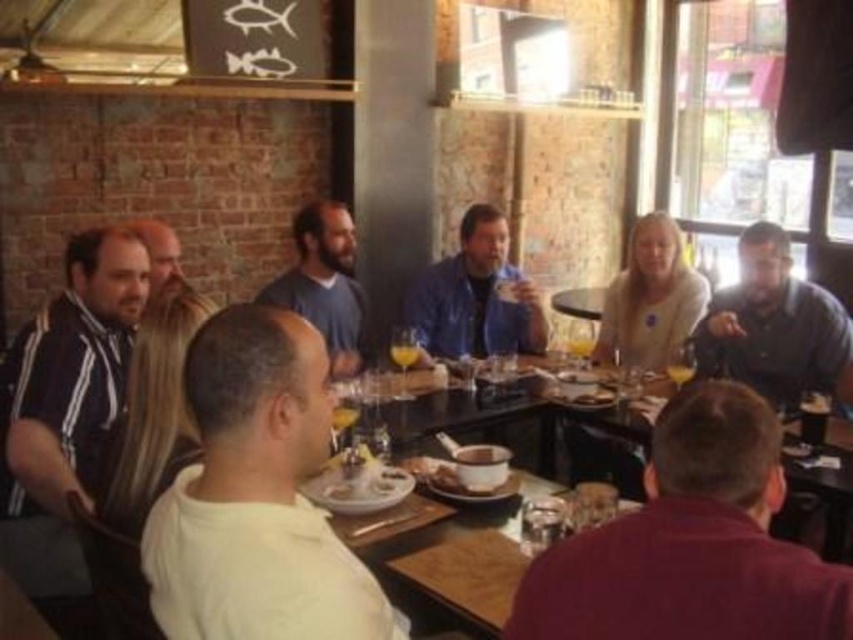
Which of these two, maroon sweater at lower right or blue denim jacket at center, stands taller?

Standing taller between the two is blue denim jacket at center.

In the scene shown: Can you confirm if maroon sweater at lower right is shorter than blue denim jacket at center?

Yes, maroon sweater at lower right is shorter than blue denim jacket at center.

At what (x,y) coordinates should I click in order to perform the action: click on maroon sweater at lower right. Please return your answer as a coordinate pair (x, y). The image size is (853, 640). Looking at the image, I should click on (691, 544).

Where is `maroon sweater at lower right`? Image resolution: width=853 pixels, height=640 pixels. maroon sweater at lower right is located at coordinates (691, 544).

Between wooden table at center and bearded man at left, which one has more height?

bearded man at left

Measure the distance between point (456, 572) and camera.

They are 5.86 feet apart.

Identify the location of wooden table at center. (467, 573).

This screenshot has height=640, width=853. What are the coordinates of `wooden table at center` in the screenshot? It's located at (467, 573).

Can you confirm if blue denim jacket at center is positioned to the right of bearded man at left?

Correct, you'll find blue denim jacket at center to the right of bearded man at left.

Which is above, blue denim jacket at center or bearded man at left?

bearded man at left is higher up.

Does point (465, 262) lie behind point (132, 228)?

Yes.

I want to click on blue denim jacket at center, so [476, 296].